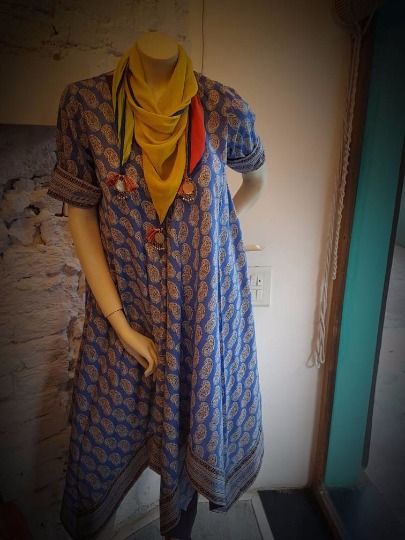
Find the location of `white wall`. white wall is located at coordinates (289, 241).